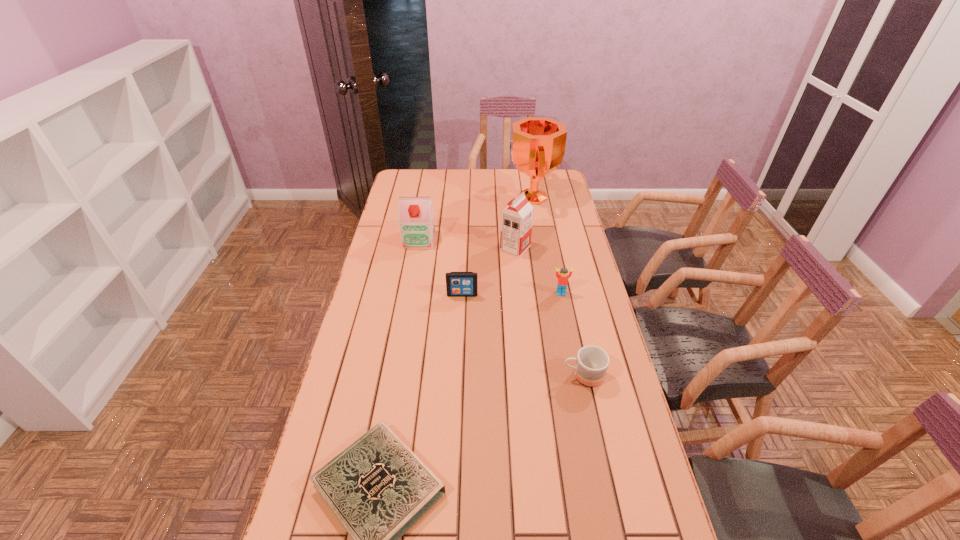
This screenshot has height=540, width=960. In order to click on award in this screenshot , I will do `click(537, 147)`.

Find the location of `the farthest object`. the farthest object is located at coordinates (537, 147).

Find the location of `the second tallest object`. the second tallest object is located at coordinates (516, 219).

This screenshot has width=960, height=540. What are the coordinates of `the taller soya milk` in the screenshot? It's located at (516, 219).

Locate an element on the screen. The height and width of the screenshot is (540, 960). the third tallest object is located at coordinates (416, 216).

Find the location of a particular element. The width and height of the screenshot is (960, 540). the shorter soya milk is located at coordinates (416, 216).

Identify the location of Lego. (562, 282).

Find the location of a particular element. iPod is located at coordinates (x=458, y=284).

You are a GUI agent. You are given a task and a screenshot of the screen. Output one action in this format:
    pyautogui.click(x=<x>, y=<y>)
    Task: Click on the sixth farthest object
    
    Given the screenshot: What is the action you would take?
    (592, 362)

At what (x,y) coordinates should I click in order to perform the action: click on mug. Please return your answer as a coordinate pair (x, y). The height and width of the screenshot is (540, 960). Looking at the image, I should click on (592, 362).